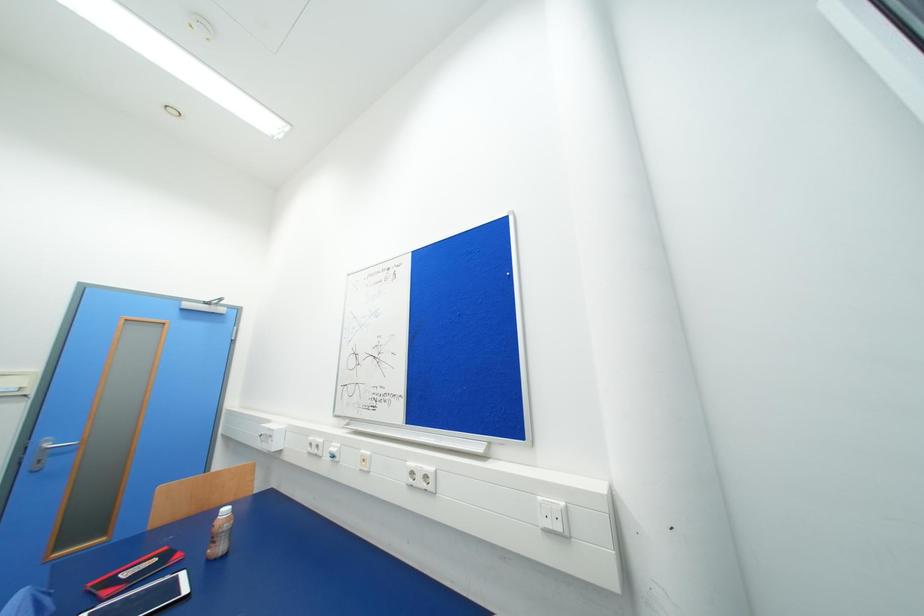
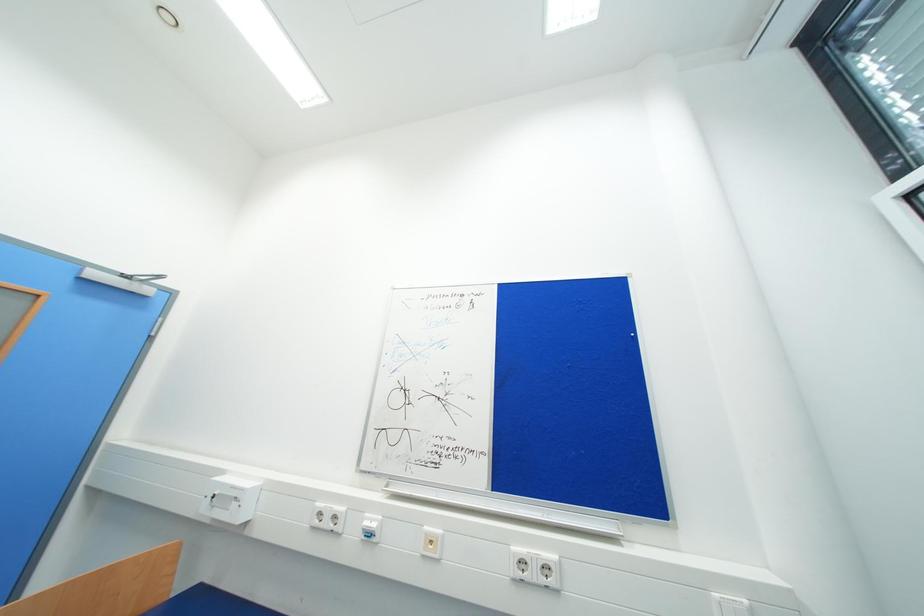
Question: What movement of the cameraman would produce the second image?

Choices:
 (A) Left
 (B) Right
 (C) Forward
 (D) Backward

Answer: (A)